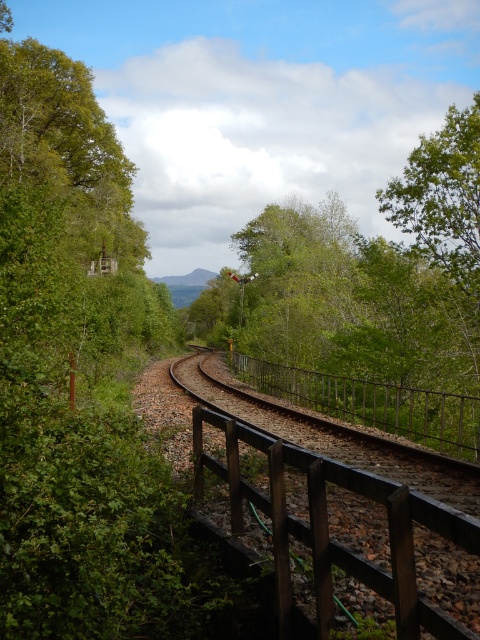
You are standing at the edge of the railway and want to reach a specific point marked as point (x=322, y=476). Given that the wooden fence on the right is 10 feet away from you, can you safely walk towards the point without crossing the fence?

The distance of point (x=322, y=476) from viewer is 12.07 feet, which is further than the wooden fence on the right at 10 feet away. Therefore, walking towards the point would require crossing the fence, so it is not safe to proceed without crossing the fence.

You are standing on the left side of the railway and want to cross to the right side. There is a brown wooden fence at center and a black metal rail at center in your view. Which object should you move towards to safely cross the tracks?

You should move towards the brown wooden fence at center because it is positioned to the left of the black metal rail at center, meaning it is closer to your current position on the left side of the railway. Crossing near the fence would be safer as it is closer and you can navigate around it more easily.

From the picture: You are standing at the point marked as point [327,529] in the image. What object are you facing?

The point [327,529] corresponds to the brown wooden fence at center, so you are facing the brown wooden fence at center.